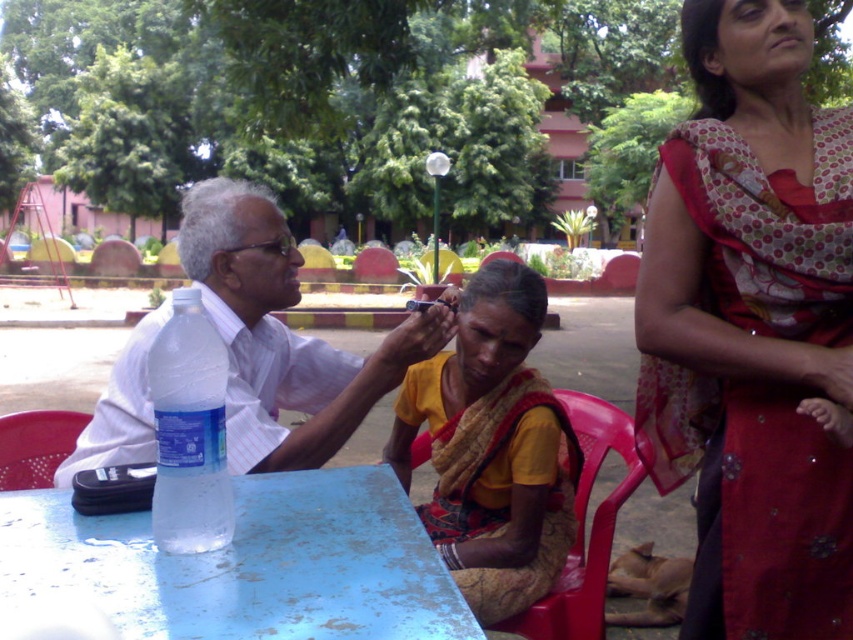
Question: Is red floral sari at upper right to the left of plastic chair at lower left from the viewer's perspective?

Choices:
 (A) yes
 (B) no

Answer: (B)

Question: Among these objects, which one is nearest to the camera?

Choices:
 (A) plastic chair at lower left
 (B) clear plastic bottle at table left
 (C) red floral sari at upper right
 (D) white glossy shirt at upper left

Answer: (B)

Question: Which point is closer to the camera?

Choices:
 (A) (177, 424)
 (B) (775, 276)
 (C) (576, 404)

Answer: (A)

Question: Observing the image, what is the correct spatial positioning of blue painted wood table at lower left in reference to plastic chair at lower left?

Choices:
 (A) left
 (B) right

Answer: (B)

Question: Observing the image, what is the correct spatial positioning of red floral sari at upper right in reference to clear plastic bottle at table left?

Choices:
 (A) right
 (B) left

Answer: (A)

Question: Which object is closer to the camera taking this photo?

Choices:
 (A) red plastic chair at lower center
 (B) red floral sari at upper right
 (C) white glossy shirt at upper left

Answer: (C)